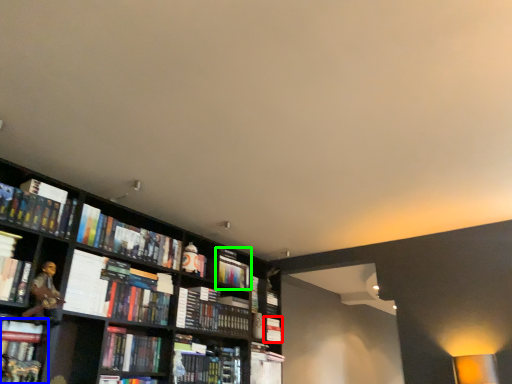
Question: Which object is positioned farthest from book (highlighted by a red box)? Select from book (highlighted by a blue box) and book (highlighted by a green box).

Choices:
 (A) book
 (B) book

Answer: (A)